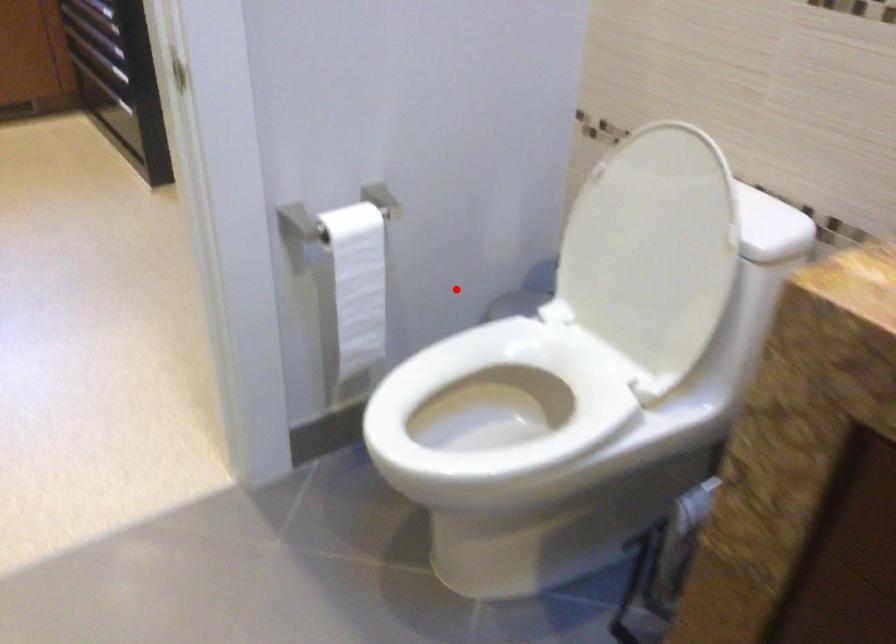
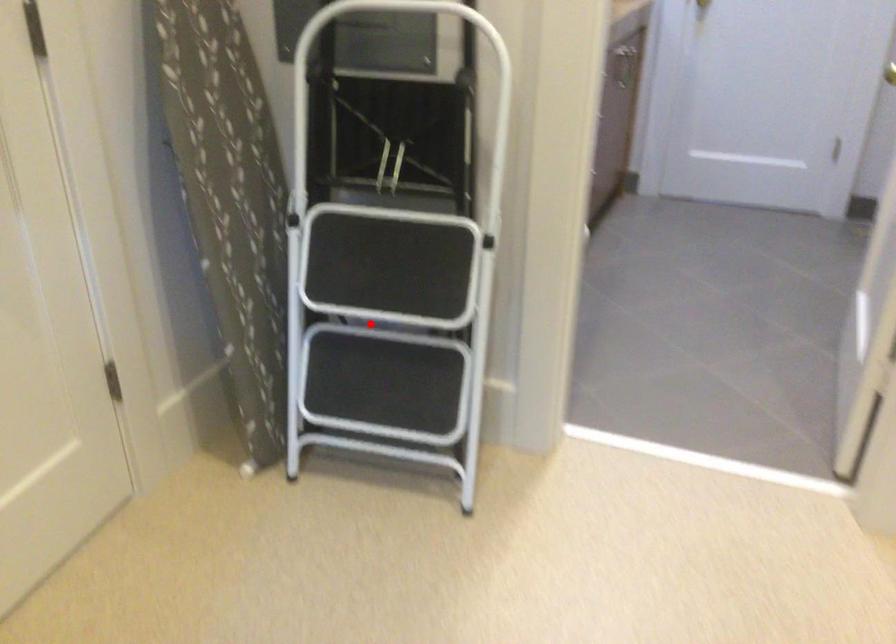
I am providing you with two images of the same scene from different viewpoints. A red point is marked on the first image and another point is marked on the second image. Is the red point in image1 aligned with the point shown in image2?

Yes